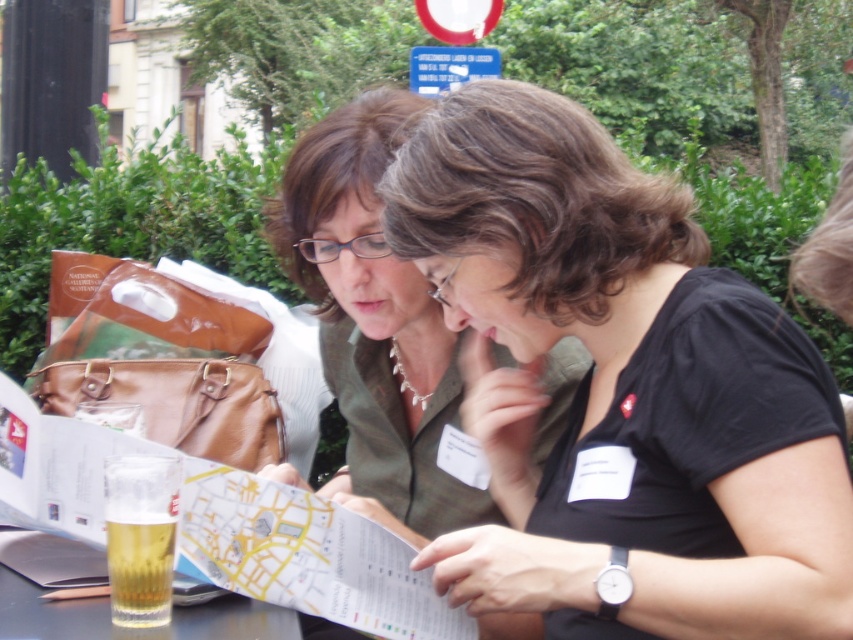
You are standing in front of the table where two people are discussing a map. There are two points marked on the map at coordinates point (669, 536) and point (361, 204). Which point is closer to you?

Point (669, 536) is closer to the viewer than point (361, 204).